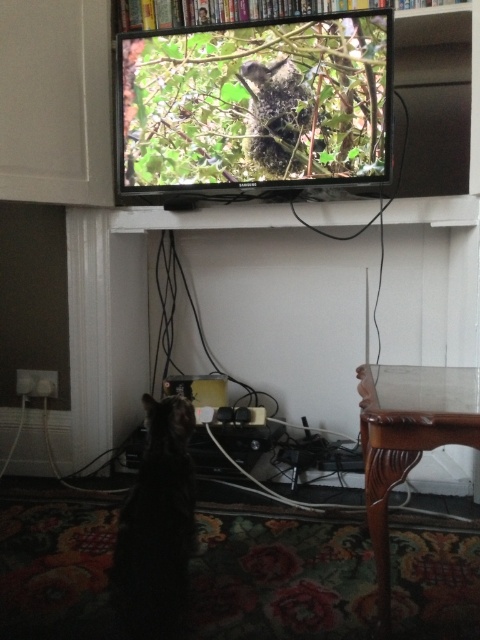
You are standing in front of the TV and want to reach both the point at coordinates point (396,467) and the point at coordinates point (308,8). Which point will require you to stretch your arm further to reach?

The point at coordinates point (308,8) will require stretching your arm further because it is farther from the camera compared to point (396,467).

You are standing in the room and want to place a new remote control on the mahogany wood table at lower right. Based on the coordinates provided, where exactly should you place it?

The mahogany wood table at lower right is located at coordinates point (408, 438), so place the remote control there.

Looking at this image, you are a guest in this living room and want to place your keys on the nearest available surface. You are currently standing between the black fur cat at lower left and the mahogany wood table at lower right. Which surface should you choose?

The black fur cat at lower left is closer to you than the mahogany wood table at lower right since the mahogany wood table at lower right is to the right of the black fur cat at lower left.